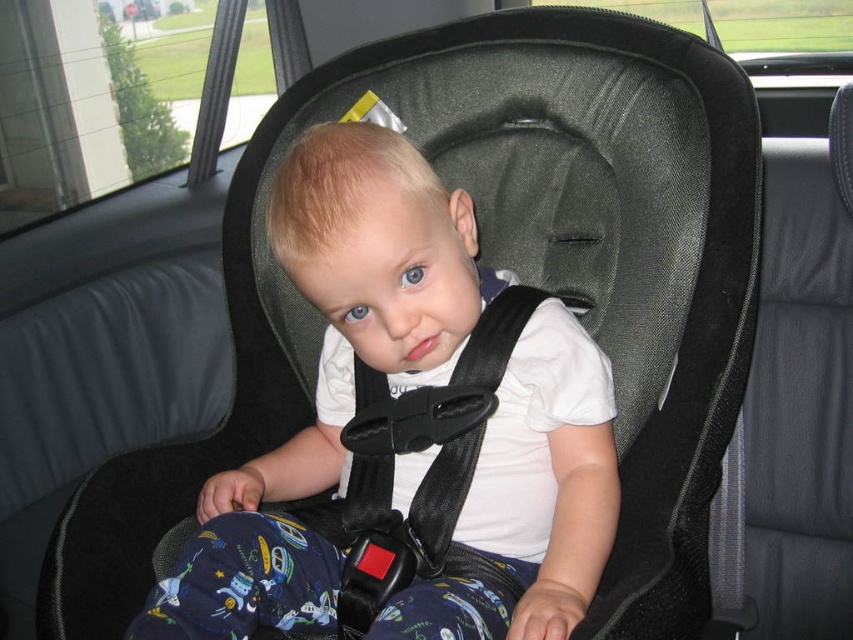
Question: Observing the image, what is the correct spatial positioning of white matte shirt at center in reference to black fabric strap at center?

Choices:
 (A) above
 (B) below

Answer: (A)

Question: Where is white matte shirt at center located in relation to black fabric strap at center in the image?

Choices:
 (A) below
 (B) above

Answer: (B)

Question: Does white matte shirt at center appear over black fabric strap at center?

Choices:
 (A) yes
 (B) no

Answer: (A)

Question: Which object appears closest to the camera in this image?

Choices:
 (A) white matte shirt at center
 (B) black fabric strap at center

Answer: (A)

Question: Which point is farther from the camera taking this photo?

Choices:
 (A) (360, 444)
 (B) (364, 285)

Answer: (A)